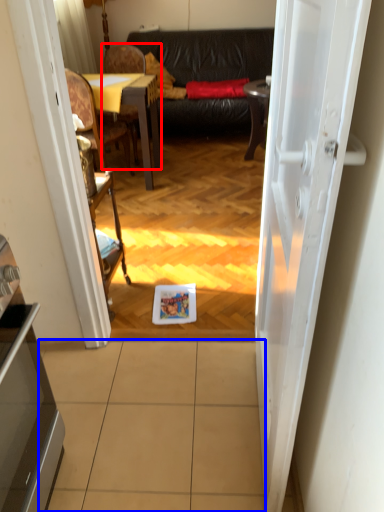
Question: Which of the following is the closest to the observer, chair (highlighted by a red box) or tile (highlighted by a blue box)?

Choices:
 (A) chair
 (B) tile

Answer: (B)